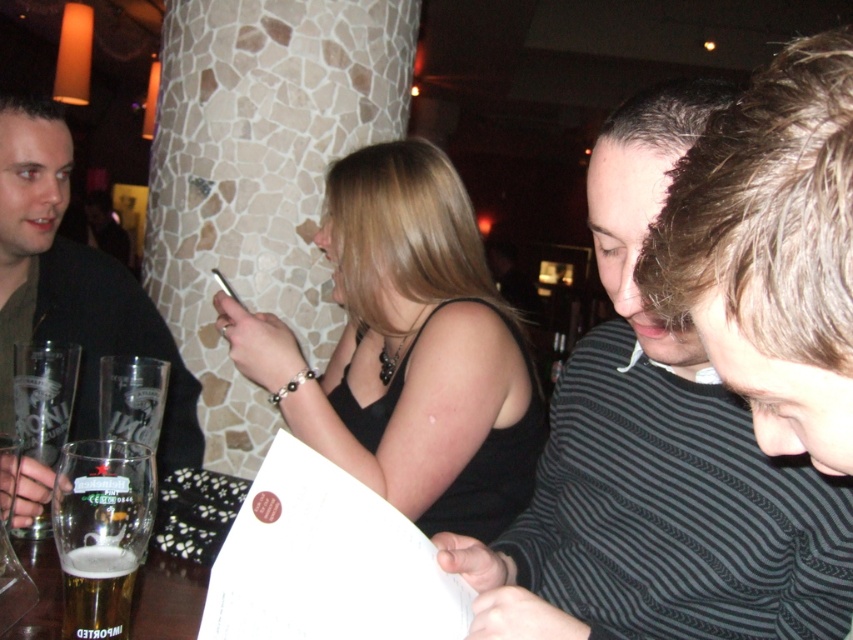
Where is the striped sweater at center located in the image?

The striped sweater at center is located at point 0.717 on the x axis and 0.771 on the y axis.

In the dimly lit bar scene, you notice two people wearing striped sweater at center and dark brown leather jacket at left. Which clothing item takes up more visual space in the image?

The striped sweater at center takes up more visual space because it is bigger than the dark brown leather jacket at left.

You are at a bar and want to ask the person in the dark brown leather jacket at left about the red circular sticker on the paper. Which direction should you walk from the striped sweater at center to reach them?

The striped sweater at center is to the right of dark brown leather jacket at left, so you should walk to the left to reach the dark brown leather jacket at left from the striped sweater at center.